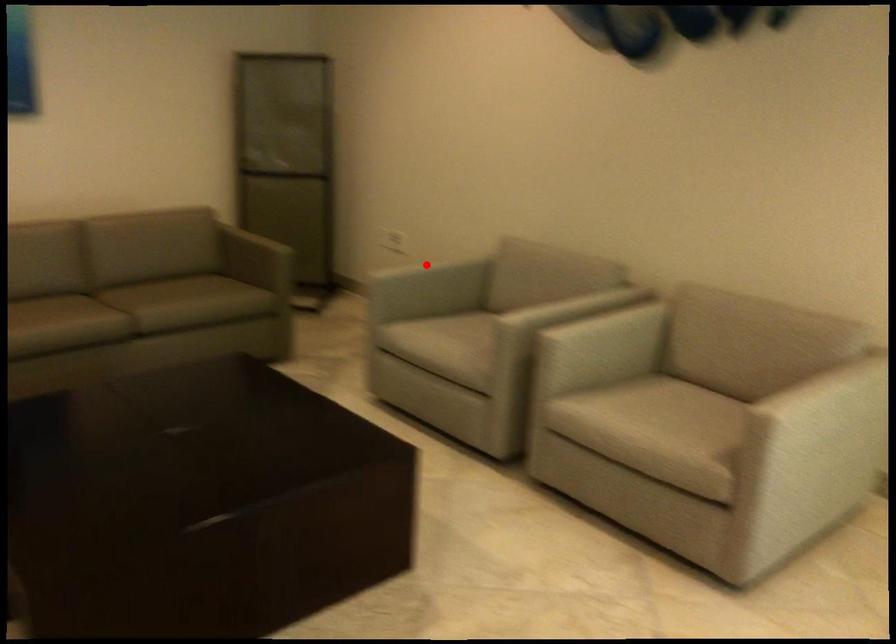
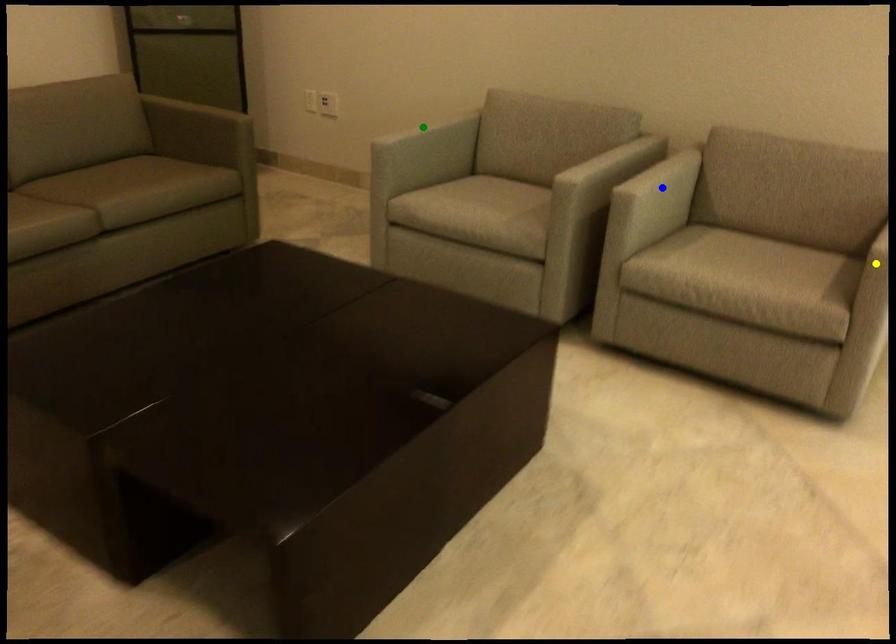
Question: I am providing you with two images of the same scene from different viewpoints. A red point is marked on the first image. You are given multiple points on the second image. Which mark in image 2 goes with the point in image 1?

Choices:
 (A) green point
 (B) blue point
 (C) yellow point

Answer: (A)